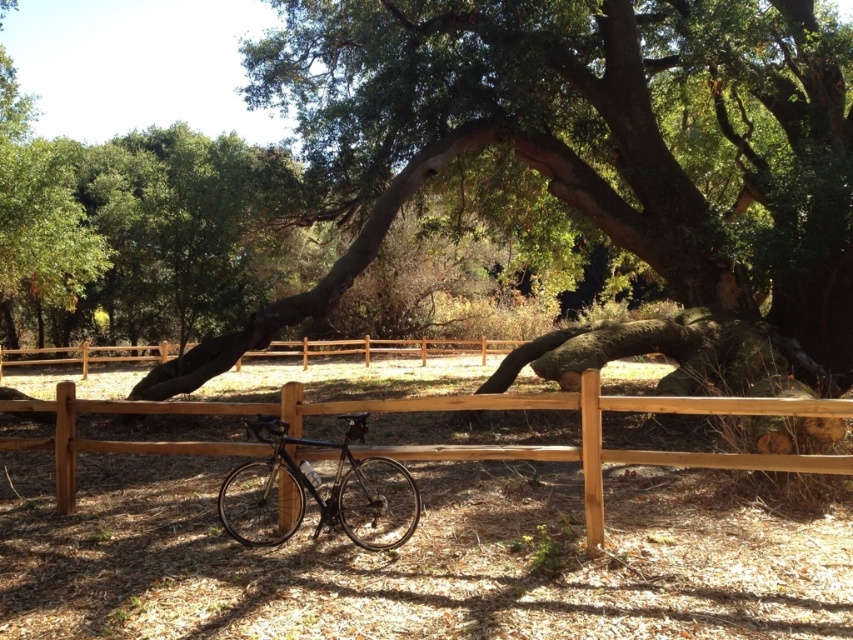
You are planning to plant a new tree in your backyard. The space available is limited in height. You see the green leafy tree at center and the brown wooden fence at center in the image. Which object would be more suitable to consider for height restrictions?

The brown wooden fence at center is shorter than the green leafy tree at center, so it would be more suitable for areas with height restrictions since it is shorter.

You are a painter setting up an easel to paint the scene. You need to ensure that the shiny black bicycle at center is visible behind the brown wooden fence at center. Based on their heights, is this possible?

The brown wooden fence at center is shorter than the shiny black bicycle at center, so the bicycle will be visible behind the fence since it is taller.